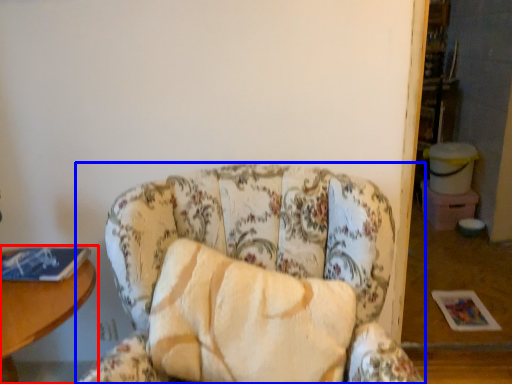
Question: Which object is further to the camera taking this photo, table (highlighted by a red box) or chair (highlighted by a blue box)?

Choices:
 (A) table
 (B) chair

Answer: (A)